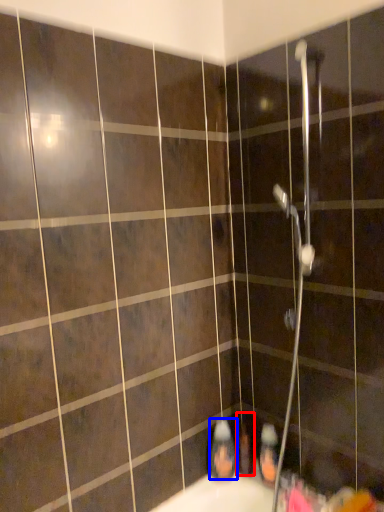
Question: Which point is further to the camera, toiletry (highlighted by a red box) or toiletry (highlighted by a blue box)?

Choices:
 (A) toiletry
 (B) toiletry

Answer: (A)